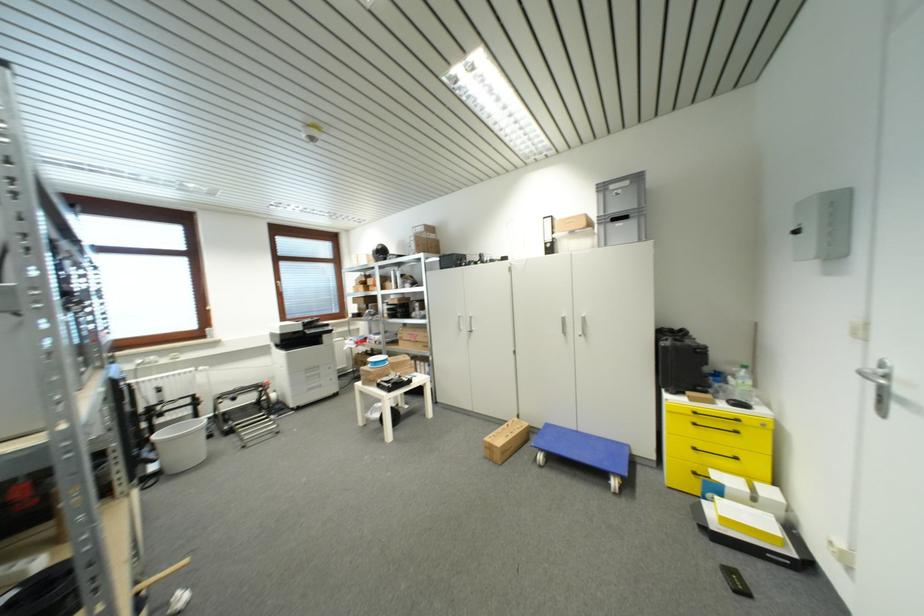
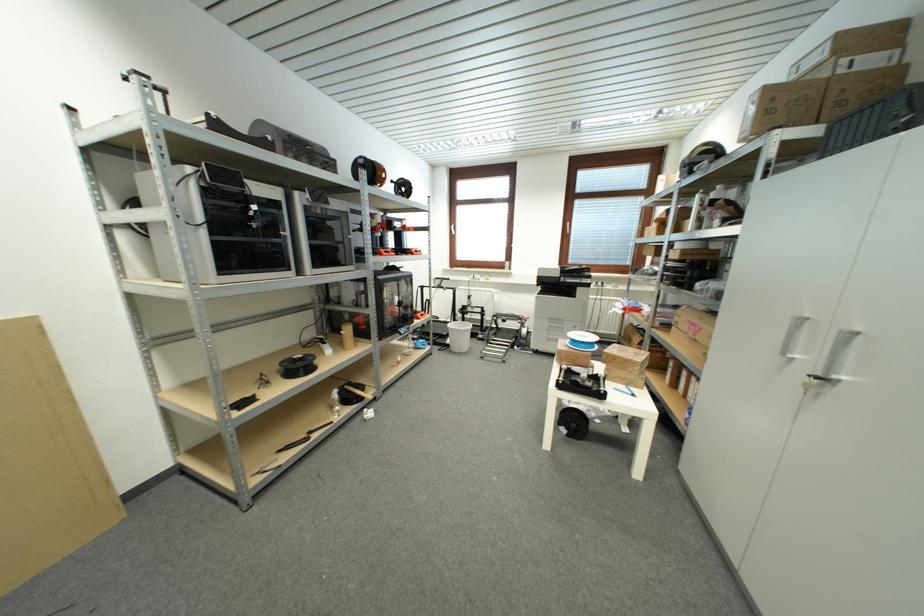
In the second image, find the point that corresponds to point 418,241 in the first image.

(761, 99)